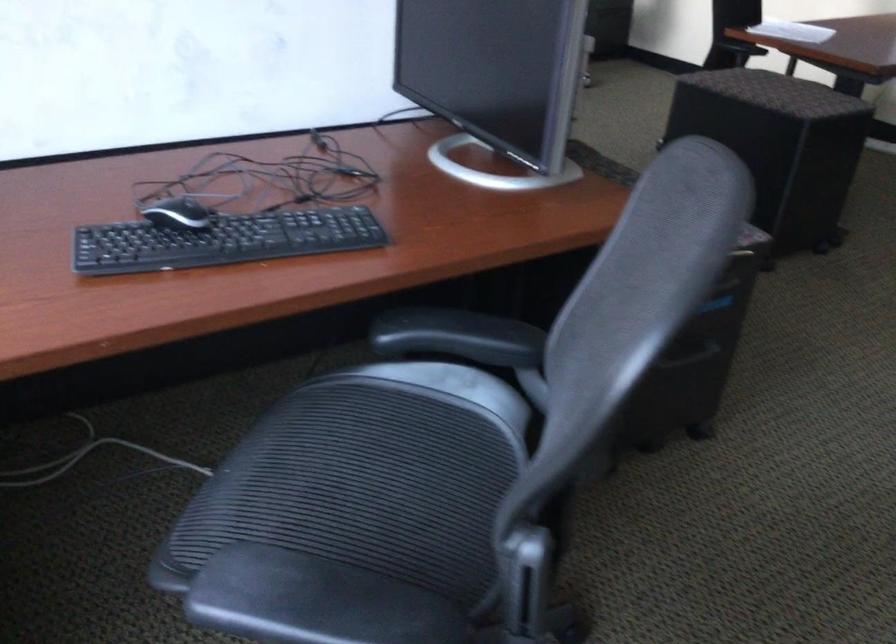
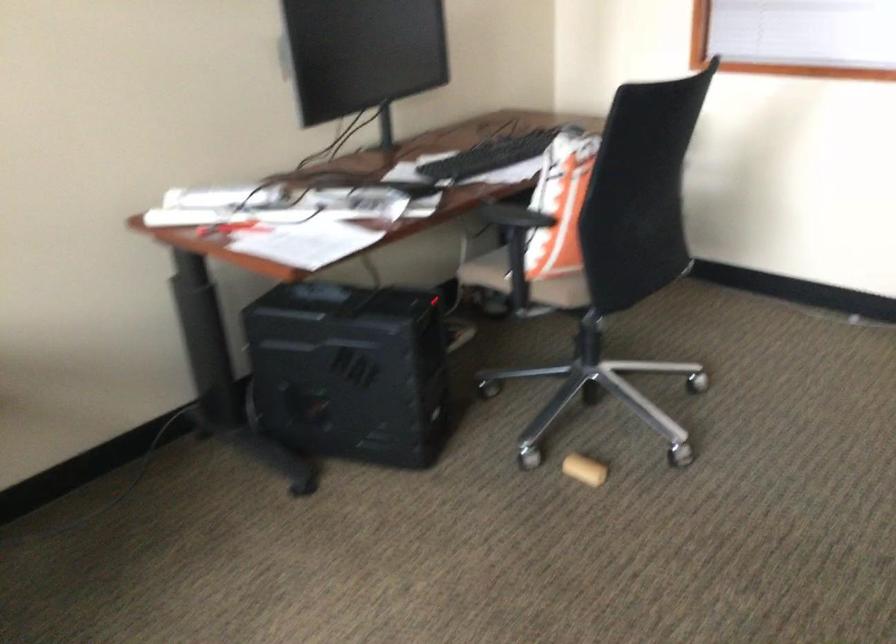
Question: The images are taken continuously from a first-person perspective. In which direction are you moving?

Choices:
 (A) Left
 (B) Right
 (C) Forward
 (D) Backward

Answer: (C)